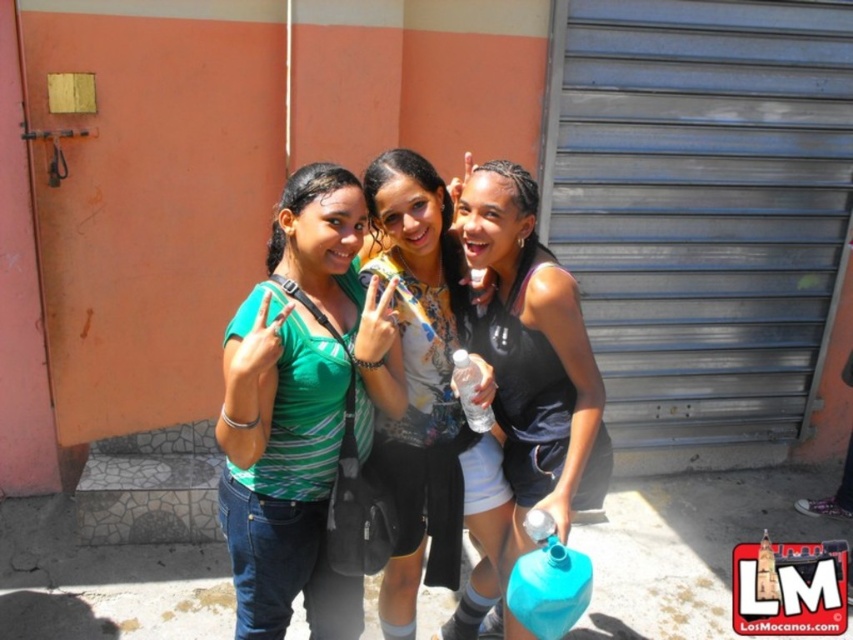
Question: Which point is closer to the camera?

Choices:
 (A) (393, 572)
 (B) (463, 380)
 (C) (281, 444)
 (D) (776, 198)

Answer: (C)

Question: Can you confirm if metallic gray garage door at right is positioned above printed fabric shirt at center?

Choices:
 (A) yes
 (B) no

Answer: (A)

Question: Is metallic gray garage door at right behind printed fabric shirt at center?

Choices:
 (A) yes
 (B) no

Answer: (A)

Question: Is metallic gray garage door at right below printed fabric shirt at center?

Choices:
 (A) no
 (B) yes

Answer: (A)

Question: Which object is closer to the camera taking this photo?

Choices:
 (A) metallic gray garage door at right
 (B) clear plastic bottle at center
 (C) black matte tank top at center
 (D) green striped shirt at center

Answer: (D)

Question: Which point is closer to the camera?

Choices:
 (A) (659, 362)
 (B) (329, 360)
 (C) (476, 422)
 (D) (563, 356)

Answer: (B)